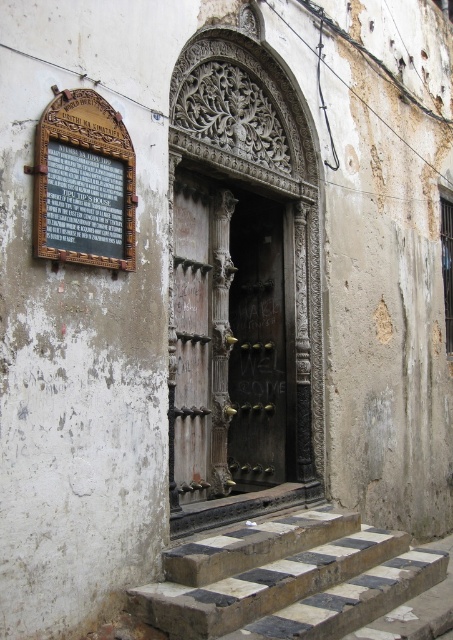
Looking at this image, you are standing in front of the stone building and want to read the text on the wooden plaque at upper left. The dark wood door at center is blocking your view. Can you determine if the plaque is taller or shorter than the door?

The wooden plaque at upper left is shorter than the dark wood door at center, so the door is taller and might be blocking the plaque.